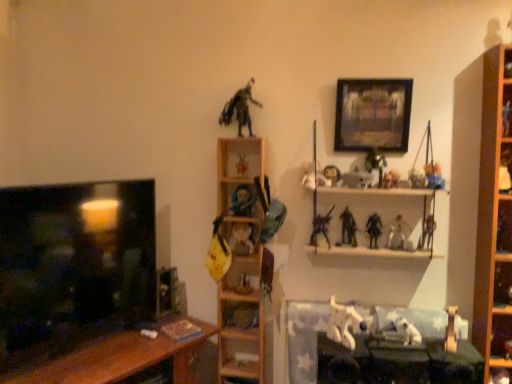
Question: From the image's perspective, relative to wooden shelf at right, which appears as the fourth shelf when viewed from the left, is matte plastic action figure at center, placed as the eighth toy when sorted from left to right, above or below?

Choices:
 (A) below
 (B) above

Answer: (B)

Question: Is matte plastic action figure at center, which is the 10th toy in right-to-left order, inside the boundaries of wooden shelf at right, which appears as the fourth shelf when viewed from the left, or outside?

Choices:
 (A) outside
 (B) inside

Answer: (A)

Question: Based on their relative distances, which object is farther from the metallic silver sword at center, which is the 5th toy from right to left?

Choices:
 (A) shiny metallic figurine at center, the fourteenth toy from the right
 (B) white matte dog at lower center
 (C) metallic silver action figure at upper right, which appears as the fifteenth toy when viewed from the left
 (D) shiny plastic toy at center, which appears as the sixteenth toy when viewed from the right
 (E) matte black tv at left

Answer: (E)

Question: Estimate the real-world distances between objects in this image. Which object is closer to the shiny metallic figurine at center, the 4th toy viewed from the left?

Choices:
 (A) shiny plastic action figure at upper right, which is the first toy in right-to-left order
 (B) wooden shelf at upper center, which ranks as the 2th shelf in right-to-left order
 (C) metallic silver figure at upper right, the second toy from the right
 (D) shiny metallic figure at upper center, which appears as the 11th toy when viewed from the right
 (E) matte black tv at left

Answer: (D)